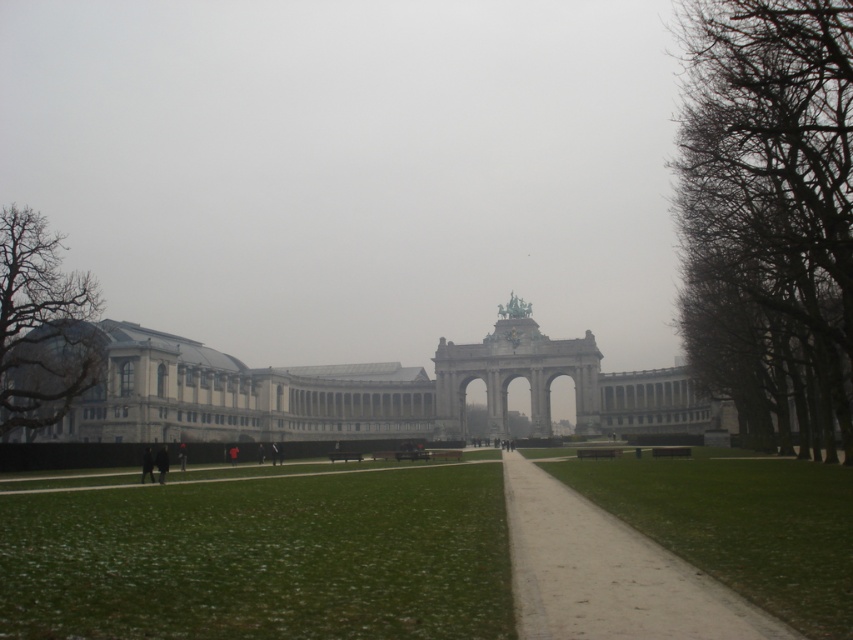
You are standing at the center of the park and want to reach the green grass at lower center. Which direction should you walk to get there?

The green grass at lower center is located at point (262,557) in the image, so you should walk towards the lower center direction to reach it.

You are standing at the entrance of the park and see two points marked in the image. The first point is at coordinates point (244,595) and the second point is at point (848,156). Which point is closer to you as you face the park entrance?

Point (244,595) is closer to you because it is in front of point (848,156).